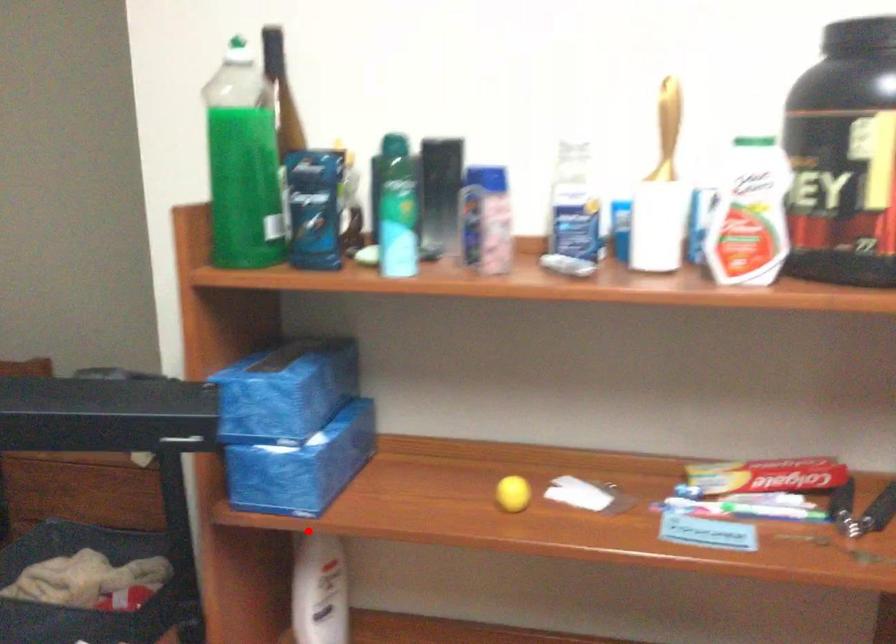
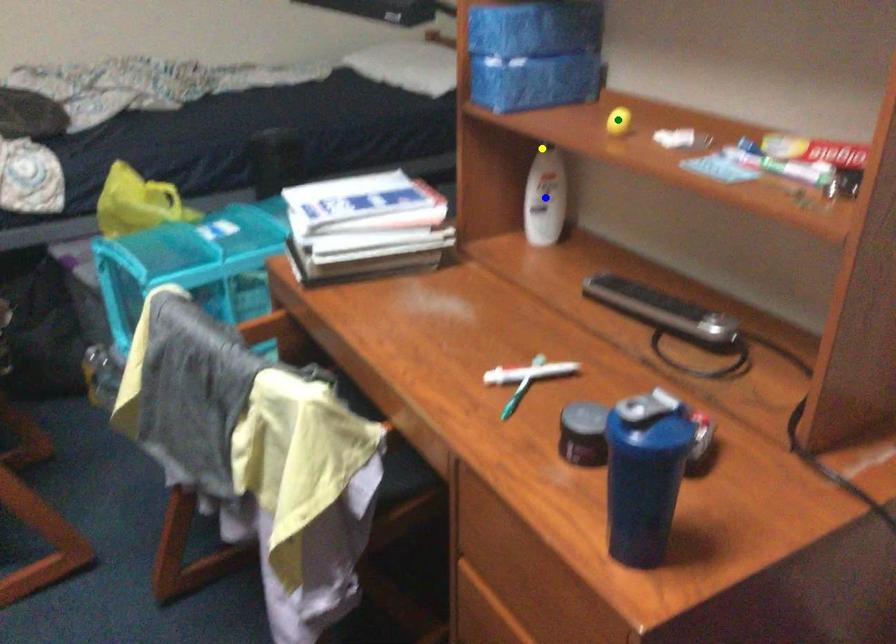
Question: I am providing you with two images of the same scene from different viewpoints. A red point is marked on the first image. You are given multiple points on the second image. Which mark in image 2 goes with the point in image 1?

Choices:
 (A) green point
 (B) yellow point
 (C) blue point

Answer: (B)